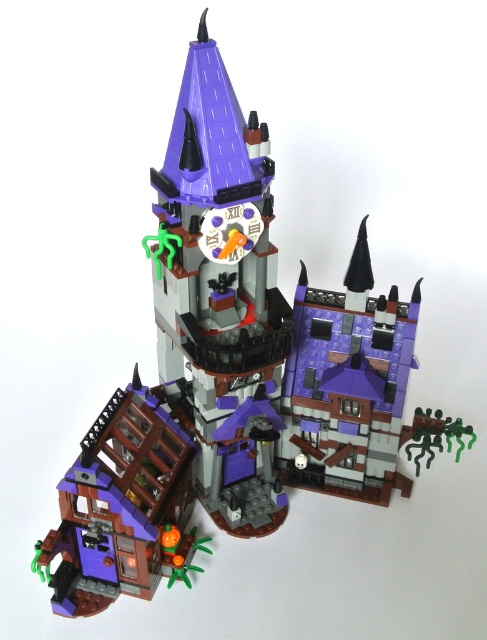
Question: Is purple matte clock tower at center thinner than matte purple house at lower left?

Choices:
 (A) yes
 (B) no

Answer: (A)

Question: Which object appears closest to the camera in this image?

Choices:
 (A) matte purple house at lower left
 (B) purple matte clock tower at center

Answer: (B)

Question: Does purple matte clock tower at center appear on the right side of matte purple house at lower left?

Choices:
 (A) yes
 (B) no

Answer: (A)

Question: Among these points, which one is nearest to the camera?

Choices:
 (A) (81, 547)
 (B) (168, 289)

Answer: (B)

Question: Can you confirm if purple matte clock tower at center is positioned above matte purple house at lower left?

Choices:
 (A) no
 (B) yes

Answer: (B)